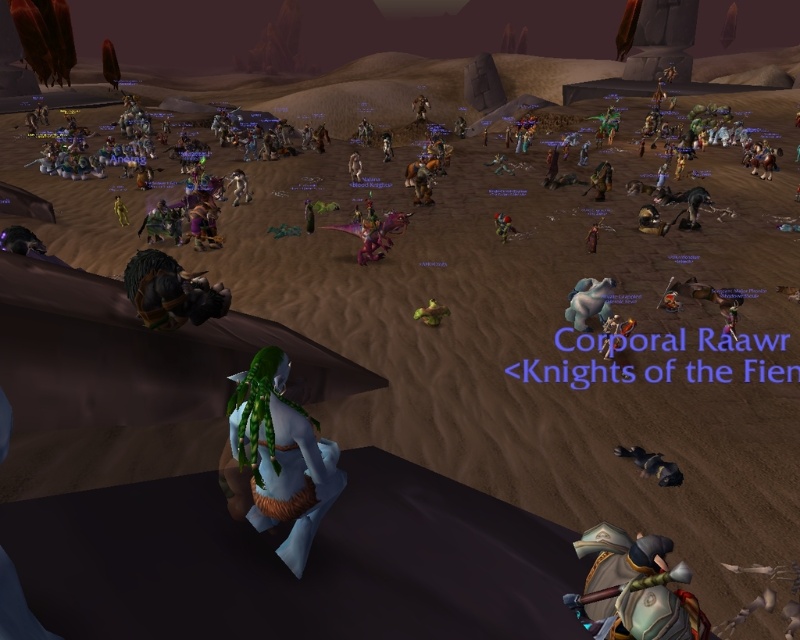
You are a character in the game trying to reach the dark gray fur at lower right located at point (652, 465). There is a platform where you are standing. Can you jump from your current platform to reach the dark gray fur at lower right? Please consider the distance between your current position and the dark gray fur at lower right.

The dark gray fur at lower right is located at point (652, 465). To determine if you can jump from your current platform to reach it, you need to know the distance between your current position and the dark gray fur at lower right. However, the exact distance isn

In the MMORPG scene, you see a shiny silver armor at lower right and a green leather armor at center. Which armor is positioned to the left?

The shiny silver armor at lower right is positioned to the left of the green leather armor at center.

You are a character in the game who wants to move from the green hair at center to the dark gray fur at lower right. Which direction should you move?

You should move to the right because the dark gray fur at lower right is located to the right of the green hair at center.